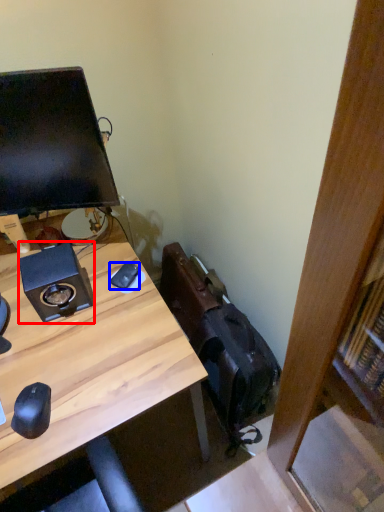
Question: Which object appears closest to the camera in this image, speaker (highlighted by a red box) or mouse (highlighted by a blue box)?

Choices:
 (A) speaker
 (B) mouse

Answer: (A)